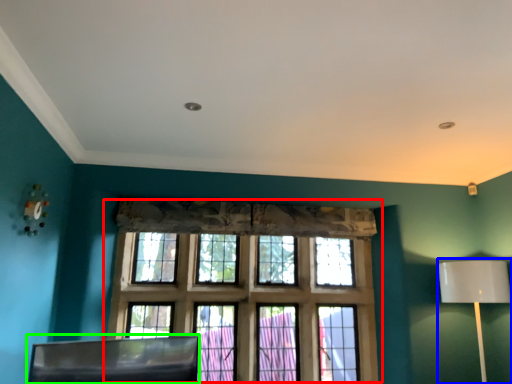
Question: Which is farther away from window (highlighted by a red box)? table lamp (highlighted by a blue box) or swivel chair (highlighted by a green box)?

Choices:
 (A) table lamp
 (B) swivel chair

Answer: (A)